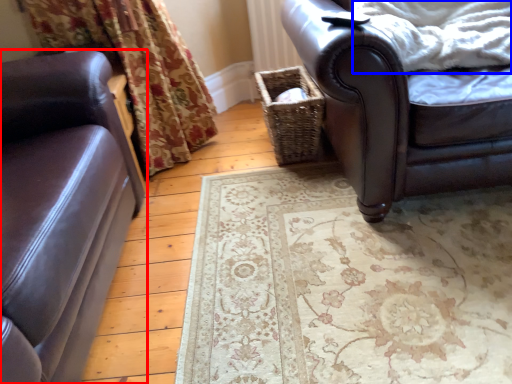
Question: Among these objects, which one is nearest to the camera, studio couch (highlighted by a red box) or blanket (highlighted by a blue box)?

Choices:
 (A) studio couch
 (B) blanket

Answer: (A)